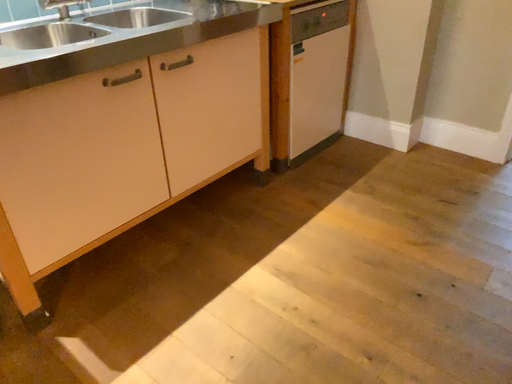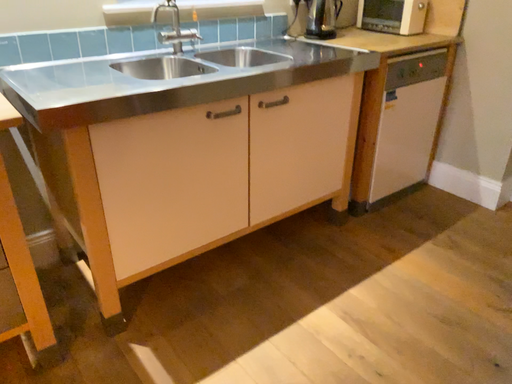
Question: Which way did the camera rotate in the video?

Choices:
 (A) rotated left
 (B) rotated right

Answer: (A)